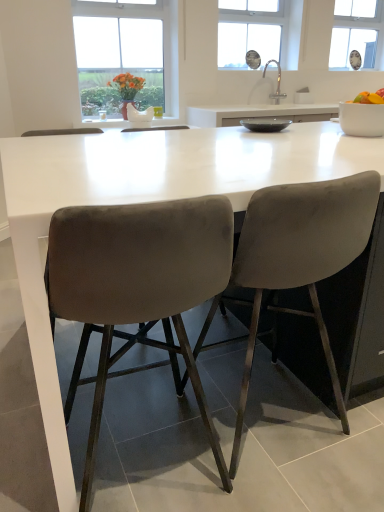
I want to click on transparent plastic window screen at upper right, so click(x=358, y=34).

Locate an element on the screen. The width and height of the screenshot is (384, 512). white ceramic sink at upper center is located at coordinates (277, 82).

Image resolution: width=384 pixels, height=512 pixels. What do you see at coordinates (137, 289) in the screenshot?
I see `velvet grey chair at center, marked as the first chair in a left-to-right arrangement` at bounding box center [137, 289].

In order to face clear glass sink at upper center, should I rotate leftwards or rightwards?

It's best to rotate right around 8.444 degrees.

Identify the location of matte gray bowl at center, marked as the 1th bowl in a left-to-right arrangement. The width and height of the screenshot is (384, 512). (265, 124).

Describe the element at coordinates (369, 98) in the screenshot. I see `yellow matte fruit bowl at right` at that location.

What is the approximate height of yellow matte fruit bowl at right?

The height of yellow matte fruit bowl at right is 11.53 centimeters.

Image resolution: width=384 pixels, height=512 pixels. Find the location of `velvet grey chair at center, the 1th chair positioned from the right`. velvet grey chair at center, the 1th chair positioned from the right is located at coordinates (297, 259).

Does point (288, 3) lie in front of point (279, 130)?

No, (288, 3) is behind (279, 130).

From the image's perspective, is clear glass sink at upper center above or below matte gray bowl at center, which appears as the 2th bowl when viewed from the right?

clear glass sink at upper center is above matte gray bowl at center, which appears as the 2th bowl when viewed from the right.

Between clear glass sink at upper center and matte gray bowl at center, which appears as the 2th bowl when viewed from the right, which one has smaller size?

With smaller size is matte gray bowl at center, which appears as the 2th bowl when viewed from the right.

How different are the orientations of transparent plastic window screen at upper right and clear glass sink at upper center in degrees?

They differ by 0.00488 degrees in their facing directions.

In terms of size, does transparent plastic window screen at upper right appear bigger or smaller than clear glass sink at upper center?

Clearly, transparent plastic window screen at upper right is smaller in size than clear glass sink at upper center.

Could you tell me if transparent plastic window screen at upper right is turned towards clear glass sink at upper center?

No, transparent plastic window screen at upper right does not turn towards clear glass sink at upper center.

From the picture: From a real-world perspective, between transparent plastic window screen at upper right and clear glass sink at upper center, who is vertically lower?

In real-world perspective, clear glass sink at upper center is lower.

At what (x,y) coordinates should I click in order to perform the action: click on chair that appears behind the velvet grey chair at center, marked as the first chair in a left-to-right arrangement. Please return your answer as a coordinate pair (x, y). Looking at the image, I should click on click(297, 259).

From a real-world perspective, is velvet grey chair at center, marked as the second chair in a left-to-right arrangement, located beneath velvet grey chair at center, marked as the first chair in a left-to-right arrangement?

No, from a real-world perspective, velvet grey chair at center, marked as the second chair in a left-to-right arrangement, is not beneath velvet grey chair at center, marked as the first chair in a left-to-right arrangement.

Can you confirm if velvet grey chair at center, marked as the second chair in a left-to-right arrangement, is positioned to the right of velvet grey chair at center, marked as the first chair in a left-to-right arrangement?

Indeed, velvet grey chair at center, marked as the second chair in a left-to-right arrangement, is positioned on the right side of velvet grey chair at center, marked as the first chair in a left-to-right arrangement.

Between velvet grey chair at center, the 1th chair positioned from the right, and velvet grey chair at center, which ranks as the 2th chair in right-to-left order, which one has less height?

Standing shorter between the two is velvet grey chair at center, which ranks as the 2th chair in right-to-left order.

Based on the photo, looking at their sizes, would you say transparent plastic window screen at upper right is wider or thinner than white matte bowl at upper right, the 2th bowl viewed from the left?

Clearly, transparent plastic window screen at upper right has less width compared to white matte bowl at upper right, the 2th bowl viewed from the left.

Is transparent plastic window screen at upper right completely or partially outside of white matte bowl at upper right, the 2th bowl viewed from the left?

transparent plastic window screen at upper right lies outside white matte bowl at upper right, the 2th bowl viewed from the left,'s area.

Is transparent plastic window screen at upper right oriented towards white matte bowl at upper right, which appears as the 1th bowl when viewed from the right?

No, transparent plastic window screen at upper right does not turn towards white matte bowl at upper right, which appears as the 1th bowl when viewed from the right.

From a real-world perspective, which object rests below the other?

white matte bowl at upper right, which appears as the 1th bowl when viewed from the right, from a real-world perspective.

Image resolution: width=384 pixels, height=512 pixels. What are the coordinates of `sink that appears above the white matte bowl at upper right, which appears as the 1th bowl when viewed from the right (from the image's perspective)` in the screenshot? It's located at click(x=277, y=82).

Does white ceramic sink at upper center have a greater width compared to white matte bowl at upper right, the 2th bowl viewed from the left?

No.

Considering the sizes of objects white ceramic sink at upper center and white matte bowl at upper right, which appears as the 1th bowl when viewed from the right, in the image provided, who is taller, white ceramic sink at upper center or white matte bowl at upper right, which appears as the 1th bowl when viewed from the right,?

Standing taller between the two is white ceramic sink at upper center.

Does clear glass sink at upper center come in front of velvet grey chair at center, which ranks as the 2th chair in right-to-left order?

No, clear glass sink at upper center is further to the viewer.

Is clear glass sink at upper center next to velvet grey chair at center, marked as the first chair in a left-to-right arrangement?

clear glass sink at upper center and velvet grey chair at center, marked as the first chair in a left-to-right arrangement, are not in contact.

Is clear glass sink at upper center looking in the opposite direction of velvet grey chair at center, which ranks as the 2th chair in right-to-left order?

clear glass sink at upper center is not turned away from velvet grey chair at center, which ranks as the 2th chair in right-to-left order.

From their relative heights in the image, would you say clear glass sink at upper center is taller or shorter than velvet grey chair at center, which ranks as the 2th chair in right-to-left order?

In the image, clear glass sink at upper center appears to be shorter than velvet grey chair at center, which ranks as the 2th chair in right-to-left order.

Is matte gray bowl at center, which appears as the 2th bowl when viewed from the right, outside of yellow matte fruit bowl at right?

Absolutely, matte gray bowl at center, which appears as the 2th bowl when viewed from the right, is external to yellow matte fruit bowl at right.

Is matte gray bowl at center, marked as the 1th bowl in a left-to-right arrangement, in contact with yellow matte fruit bowl at right?

No, matte gray bowl at center, marked as the 1th bowl in a left-to-right arrangement, is not with yellow matte fruit bowl at right.

Who is bigger, matte gray bowl at center, marked as the 1th bowl in a left-to-right arrangement, or yellow matte fruit bowl at right?

With larger size is matte gray bowl at center, marked as the 1th bowl in a left-to-right arrangement.

The width and height of the screenshot is (384, 512). Identify the location of the 1st bowl in front of the clear glass sink at upper center, starting your count from the anchor. (265, 124).

At what (x,y) coordinates should I click in order to perform the action: click on window screen above the clear glass sink at upper center (from the image's perspective). Please return your answer as a coordinate pair (x, y). The height and width of the screenshot is (512, 384). Looking at the image, I should click on (358, 34).

When comparing their distances from white ceramic sink at upper center, does transparent plastic window screen at upper right or velvet grey chair at center, marked as the second chair in a left-to-right arrangement, seem further?

velvet grey chair at center, marked as the second chair in a left-to-right arrangement, is positioned further to the anchor white ceramic sink at upper center.

Looking at the image, which one is located closer to white ceramic sink at upper center, white matte bowl at upper right, which appears as the 1th bowl when viewed from the right, or velvet grey chair at center, the 1th chair positioned from the right?

white matte bowl at upper right, which appears as the 1th bowl when viewed from the right, is positioned closer to the anchor white ceramic sink at upper center.

Looking at the image, which one is located further to transparent plastic window screen at upper right, velvet grey chair at center, marked as the first chair in a left-to-right arrangement, or velvet grey chair at center, the 1th chair positioned from the right?

The object further to transparent plastic window screen at upper right is velvet grey chair at center, marked as the first chair in a left-to-right arrangement.

When comparing their distances from yellow matte fruit bowl at right, does white ceramic sink at upper center or velvet grey chair at center, which ranks as the 2th chair in right-to-left order, seem closer?

The object closer to yellow matte fruit bowl at right is velvet grey chair at center, which ranks as the 2th chair in right-to-left order.

In the scene shown: Based on their spatial positions, is velvet grey chair at center, which ranks as the 2th chair in right-to-left order, or matte gray bowl at center, which appears as the 2th bowl when viewed from the right, further from transparent plastic window screen at upper right?

Based on the image, velvet grey chair at center, which ranks as the 2th chair in right-to-left order, appears to be further to transparent plastic window screen at upper right.

Based on their spatial positions, is white ceramic sink at upper center or matte gray bowl at center, marked as the 1th bowl in a left-to-right arrangement, further from velvet grey chair at center, which ranks as the 2th chair in right-to-left order?

white ceramic sink at upper center.

Considering their positions, is transparent plastic window screen at upper right positioned further to yellow matte fruit bowl at right than white ceramic sink at upper center?

transparent plastic window screen at upper right is further to yellow matte fruit bowl at right.

Considering their positions, is velvet grey chair at center, marked as the second chair in a left-to-right arrangement, positioned further to yellow matte fruit bowl at right than matte gray bowl at center, marked as the 1th bowl in a left-to-right arrangement?

velvet grey chair at center, marked as the second chair in a left-to-right arrangement, is further to yellow matte fruit bowl at right.

Where is `window between matte gray bowl at center, which appears as the 2th bowl when viewed from the right, and transparent plastic window screen at upper right in the front-back direction`? The width and height of the screenshot is (384, 512). window between matte gray bowl at center, which appears as the 2th bowl when viewed from the right, and transparent plastic window screen at upper right in the front-back direction is located at coordinates (252, 31).

This screenshot has height=512, width=384. Find the location of `chair between velvet grey chair at center, which ranks as the 2th chair in right-to-left order, and white matte bowl at upper right, the 2th bowl viewed from the left, in the front-back direction`. chair between velvet grey chair at center, which ranks as the 2th chair in right-to-left order, and white matte bowl at upper right, the 2th bowl viewed from the left, in the front-back direction is located at coordinates (297, 259).

This screenshot has width=384, height=512. Identify the location of bowl between velvet grey chair at center, which ranks as the 2th chair in right-to-left order, and matte gray bowl at center, which appears as the 2th bowl when viewed from the right, along the z-axis. (362, 119).

I want to click on food between velvet grey chair at center, which ranks as the 2th chair in right-to-left order, and transparent plastic window screen at upper right, along the z-axis, so click(x=369, y=98).